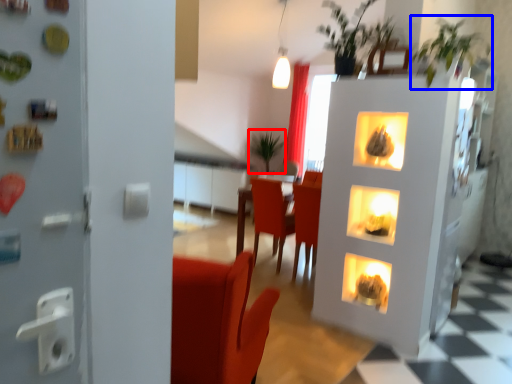
Question: Which of the following is the farthest to the observer, plant (highlighted by a red box) or plant (highlighted by a blue box)?

Choices:
 (A) plant
 (B) plant

Answer: (A)